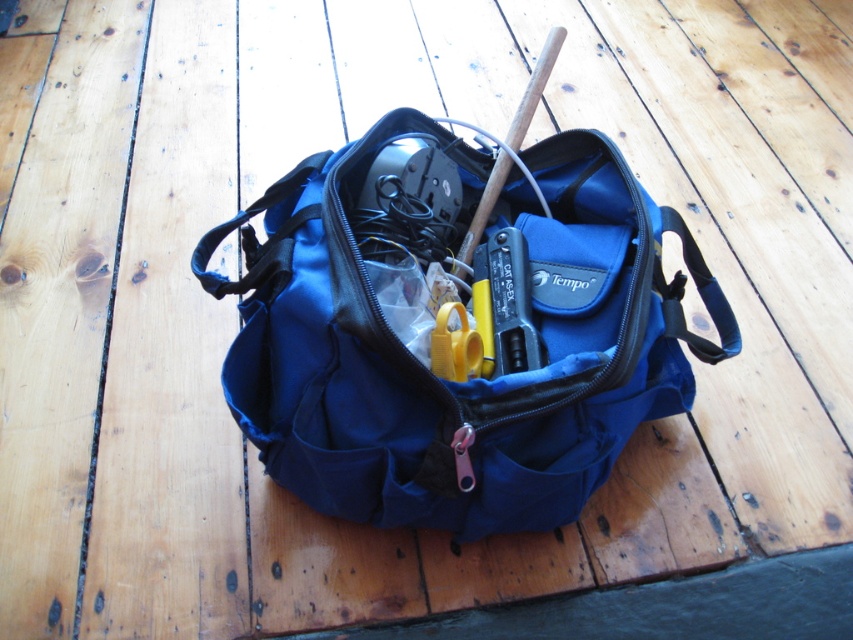
You need to place a 12 inch ruler into the blue fabric tool bag at center. Can the ruler fit vertically inside the bag if the yellow plastic scissors at center is currently occupying space inside?

The blue fabric tool bag at center is much taller than the yellow plastic scissors at center, so there should be enough vertical space to fit a 12 inch ruler inside even with the scissors present.

You are organizing tools in the open blue tool bag. You need to access the yellow plastic scissors at center. Is the metallic gray tool at center blocking your access to them?

Yes, the yellow plastic scissors at center is behind metallic gray tool at center, so the metallic gray tool is blocking access to the scissors.